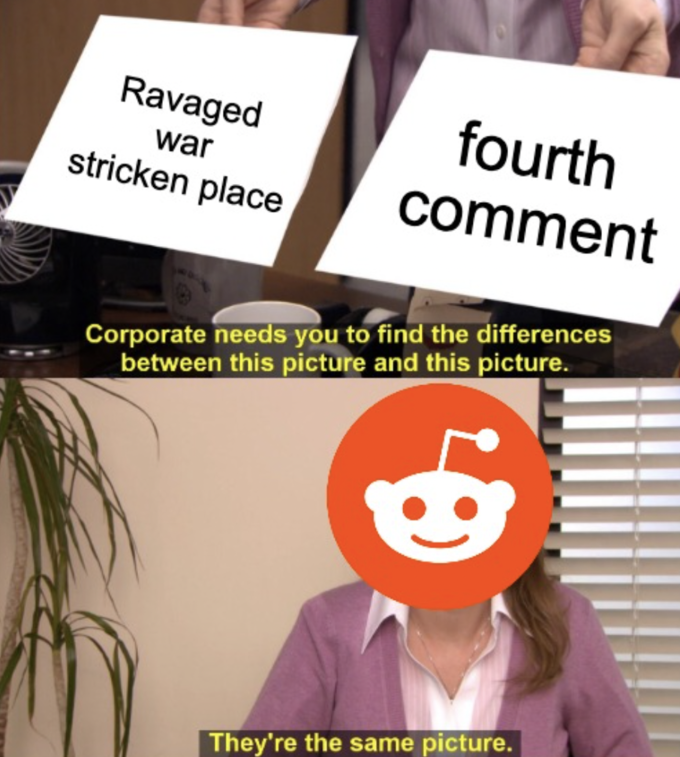
Where is `empty wall`? The height and width of the screenshot is (757, 680). empty wall is located at coordinates (248, 484).